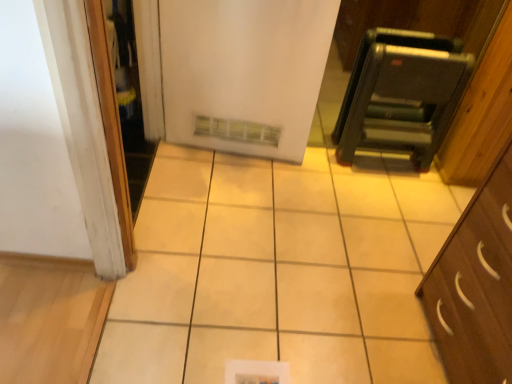
Question: Is metallic black step ladder at upper right taller or shorter than white glossy screen door at left?

Choices:
 (A) tall
 (B) short

Answer: (B)

Question: From a real-world perspective, is metallic black step ladder at upper right above or below white glossy screen door at left?

Choices:
 (A) above
 (B) below

Answer: (B)

Question: Estimate the real-world distances between objects in this image. Which object is closer to the metallic black step ladder at upper right?

Choices:
 (A) white glossy screen door at left
 (B) white matte refrigerator at center

Answer: (B)

Question: Which of these objects is positioned farthest from the white matte refrigerator at center?

Choices:
 (A) white glossy screen door at left
 (B) metallic black step ladder at upper right

Answer: (B)